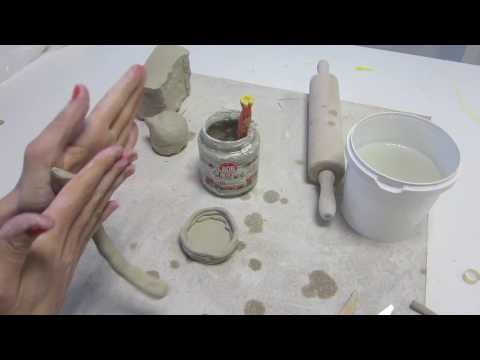
Find the location of a particular element. floor is located at coordinates (466, 48).